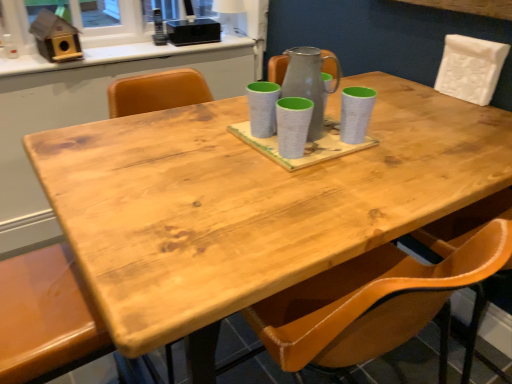
Locate an element on the screen. This screenshot has height=384, width=512. free space that is in between white matte chair at upper right, arranged as the first chair when viewed from the right, and speckled ceramic mug at center, acting as the third mug starting from the left is located at coordinates (418, 119).